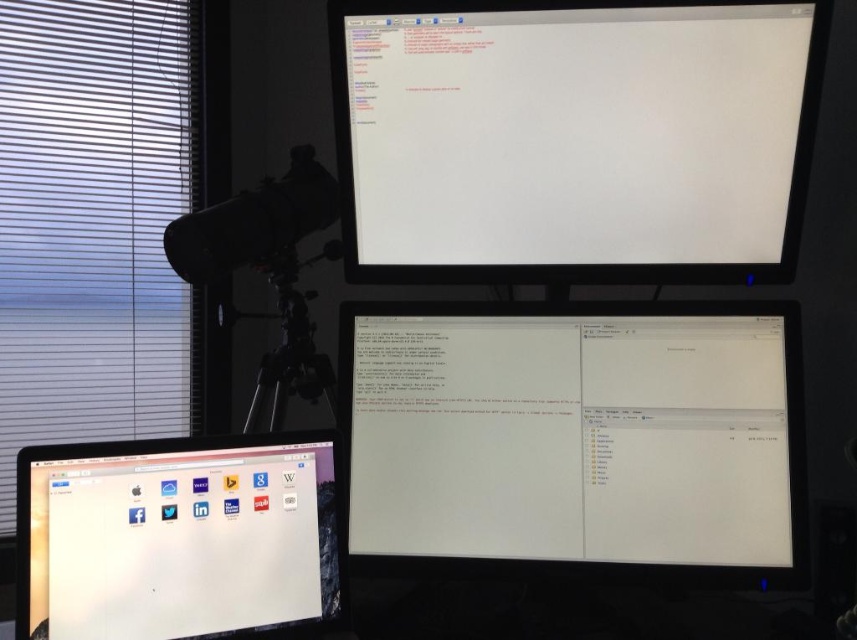
Is white glossy monitor at center bigger than black matte tripod at center?

Incorrect, white glossy monitor at center is not larger than black matte tripod at center.

Identify the location of white glossy monitor at center. (576, 438).

Where is `white glossy monitor at center`? white glossy monitor at center is located at coordinates (576, 438).

The height and width of the screenshot is (640, 857). Describe the element at coordinates (576, 438) in the screenshot. I see `white glossy monitor at center` at that location.

Is white glossy monitor at center behind matte black monitor at lower left?

Yes, it is.

Measure the distance between white glossy monitor at center and camera.

white glossy monitor at center is 1.11 meters from camera.

Locate an element on the screen. The height and width of the screenshot is (640, 857). white glossy monitor at center is located at coordinates (576, 438).

Who is lower down, white glossy monitor at upper center or black matte tripod at center?

black matte tripod at center is below.

Can you confirm if white glossy monitor at upper center is positioned below black matte tripod at center?

Incorrect, white glossy monitor at upper center is not positioned below black matte tripod at center.

Identify the location of white glossy monitor at upper center. This screenshot has height=640, width=857. [x=574, y=138].

Where is `white glossy monitor at upper center`? white glossy monitor at upper center is located at coordinates (574, 138).